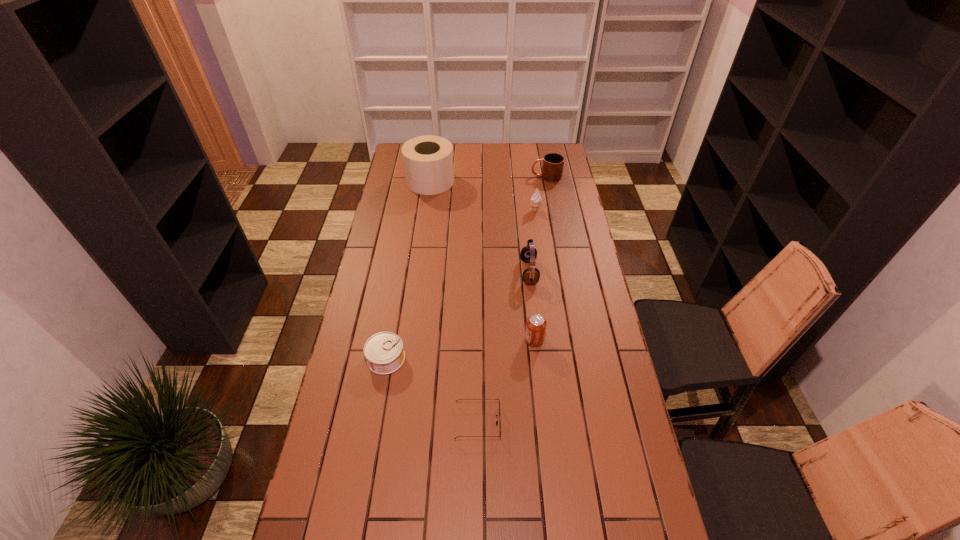
This screenshot has height=540, width=960. I want to click on free space between the mug and the sunglasses, so click(x=512, y=299).

You are a GUI agent. You are given a task and a screenshot of the screen. Output one action in this format:
    pyautogui.click(x=<x>, y=<y>)
    Task: Click on the empty location between the fourth nearest object and the right can
    The width and height of the screenshot is (960, 540).
    Given the screenshot: What is the action you would take?
    pyautogui.click(x=532, y=306)

Find the location of `free space between the shorter can and the sunglasses`. free space between the shorter can and the sunglasses is located at coordinates (432, 390).

This screenshot has width=960, height=540. What are the coordinates of `free point between the third object from left to right and the third farthest object` in the screenshot? It's located at (506, 316).

Find the location of `vacant area between the taller can and the shortest object`. vacant area between the taller can and the shortest object is located at coordinates (506, 381).

Find the location of `vacant point located between the shortest object and the mug`. vacant point located between the shortest object and the mug is located at coordinates (512, 299).

Identify the location of free spot between the mug and the fifth nearest object. (540, 193).

Identify the location of object that stands as the fifth closest to the sixth tallest object. (428, 163).

Image resolution: width=960 pixels, height=540 pixels. In order to click on object that is the second closest to the fourth farthest object in this screenshot , I will do `click(536, 199)`.